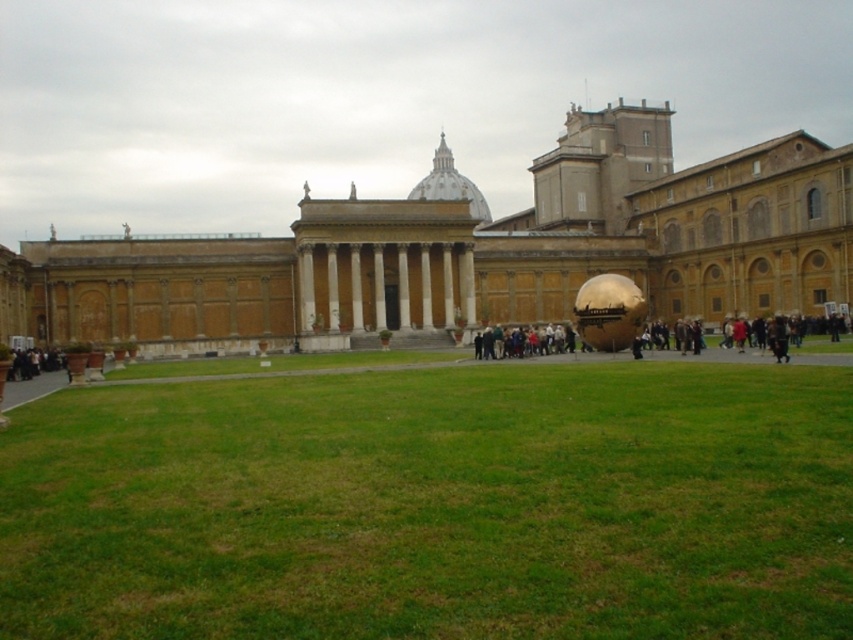
Is golden polished sphere at center above golden metallic sphere at center?

Yes.

Is golden polished sphere at center bigger than golden metallic sphere at center?

Correct, golden polished sphere at center is larger in size than golden metallic sphere at center.

Which is behind, point (323, 308) or point (573, 342)?

Point (323, 308)

The image size is (853, 640). I want to click on golden polished sphere at center, so click(473, 248).

Does green grass at center have a greater width compared to golden metallic sphere at center?

Yes.

Is green grass at center to the left of golden metallic sphere at center from the viewer's perspective?

Correct, you'll find green grass at center to the left of golden metallic sphere at center.

Identify the location of green grass at center. (434, 506).

Can you confirm if green grass at center is thinner than golden polished sphere at center?

Indeed, green grass at center has a lesser width compared to golden polished sphere at center.

Is point (463, 436) closer to camera compared to point (109, 269)?

Yes, it is in front of point (109, 269).

Between point (241, 410) and point (672, 246), which one is positioned in front?

Point (241, 410)

Image resolution: width=853 pixels, height=640 pixels. Identify the location of green grass at center. (434, 506).